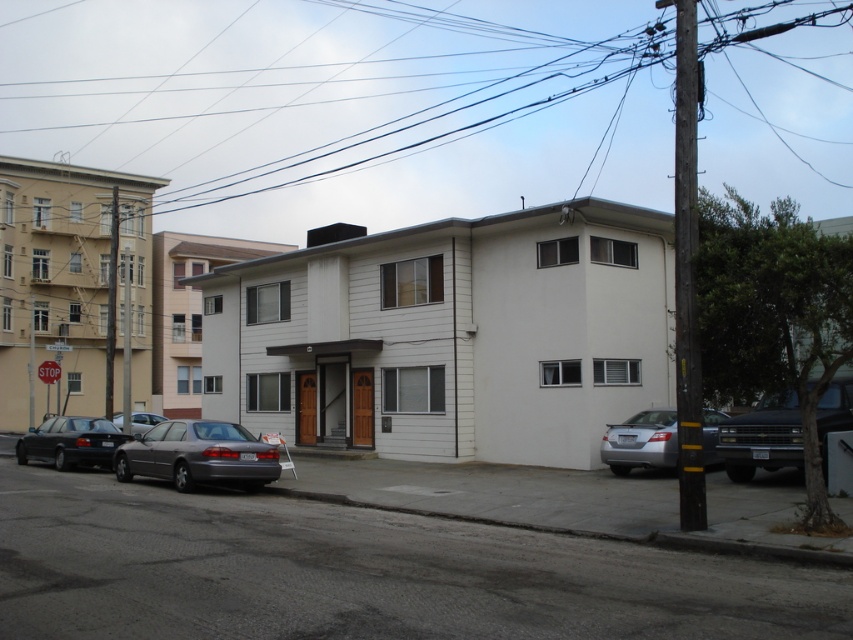
You are a delivery person needing to park your van, which is 2 meters wide, between the silver metallic sedan at lower right and the shiny black sedan at left. Based on the scene, can your van fit in the space between them?

The silver metallic sedan at lower right has a lesser width compared to shiny black sedan at left, so the space between them may be sufficient for a 2 meter wide van. However, without knowing the exact distance between the cars, it is uncertain if there is enough space. The width of the cars alone does not determine the available space between them.

You are a delivery driver who needs to park your truck next to the black glossy sedan at right and the silver metallic sedan at lower right. Since your truck is 2.2 meters wide, can you safely park between them without touching either vehicle?

The black glossy sedan at right is narrower than the silver metallic sedan at lower right. However, the exact width between them isn not provided. But since the black glossy sedan at right is narrower, there might be enough space. However, without knowing the distance between the two cars, it is impossible to determine if the 2.2 meter wide truck can fit safely between them.